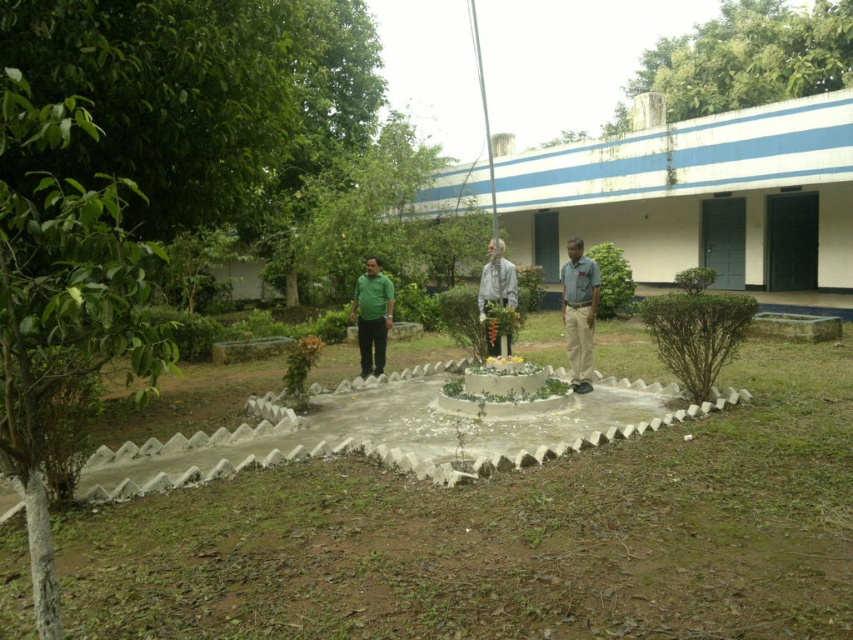
Describe the element at coordinates (749, 58) in the screenshot. This screenshot has width=853, height=640. I see `green leafy tree at upper center` at that location.

Is point (724, 32) closer to viewer compared to point (370, 333)?

No, it is not.

The width and height of the screenshot is (853, 640). Identify the location of green leafy tree at upper center. (749, 58).

Find the location of a particular element. The width and height of the screenshot is (853, 640). green leafy tree at left is located at coordinates point(65,330).

Who is more forward, (0,426) or (843,52)?

Positioned in front is point (0,426).

Identify the location of green leafy tree at left. (65, 330).

Does green leafy tree at left appear over blue shirt at center?

Incorrect, green leafy tree at left is not positioned above blue shirt at center.

Who is taller, green leafy tree at left or blue shirt at center?

blue shirt at center

Does point (115, 344) come farther from viewer compared to point (584, 365)?

No, (115, 344) is closer to viewer.

In order to click on green leafy tree at left in this screenshot , I will do `click(65, 330)`.